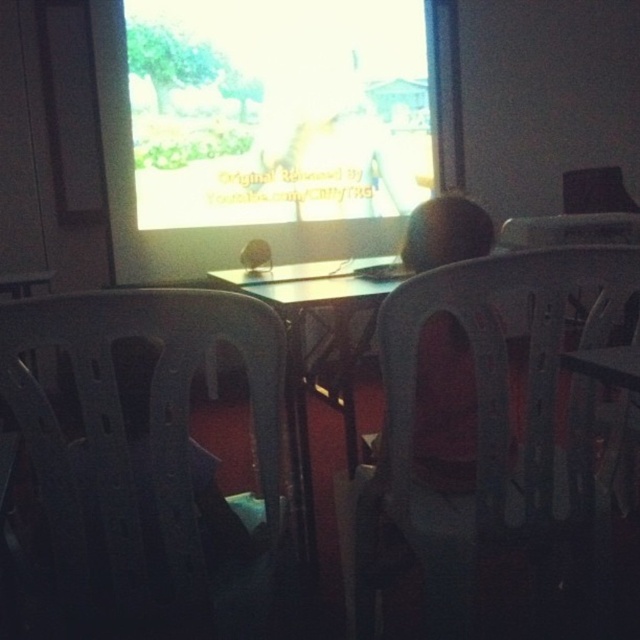
Question: Is bright yellow screen at upper center to the right of black plastic chair at left from the viewer's perspective?

Choices:
 (A) yes
 (B) no

Answer: (A)

Question: Which of the following is the farthest from the observer?

Choices:
 (A) (368, 564)
 (B) (440, 316)
 (C) (353, 65)

Answer: (C)

Question: Can you confirm if black plastic chair at left is bigger than transparent plastic chair at center?

Choices:
 (A) yes
 (B) no

Answer: (B)

Question: Based on their relative distances, which object is farther from the bright yellow screen at upper center?

Choices:
 (A) smooth plastic head at center
 (B) black plastic chair at left
 (C) transparent plastic chair at center

Answer: (B)

Question: Is bright yellow screen at upper center below transparent plastic chair at center?

Choices:
 (A) no
 (B) yes

Answer: (A)

Question: Which of these objects is positioned farthest from the bright yellow screen at upper center?

Choices:
 (A) black plastic chair at left
 (B) smooth plastic head at center
 (C) transparent plastic chair at center

Answer: (A)